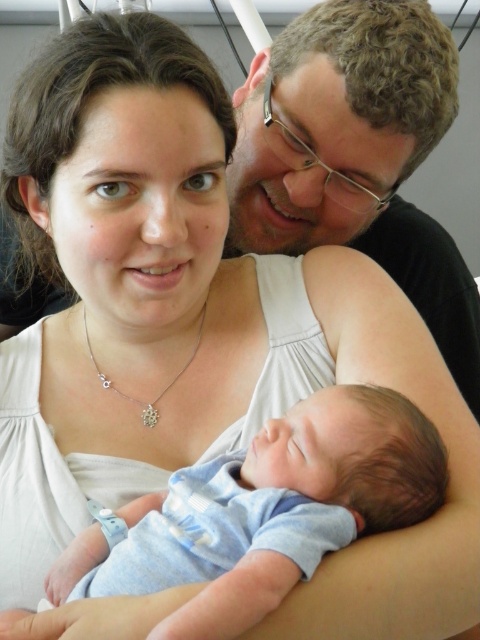
Where is the blue soft fabric newborn at center located in the image?

The blue soft fabric newborn at center is located at point (268, 512) in the image.

In the image, there are two points labeled as point 1 and point 2. Point 1 is at coordinates point (x=334, y=538) and point 2 is at point (x=127, y=394). From your perspective, which point is closer to you?

Point (x=334, y=538) is in front of point (x=127, y=394), so it is closer to you.